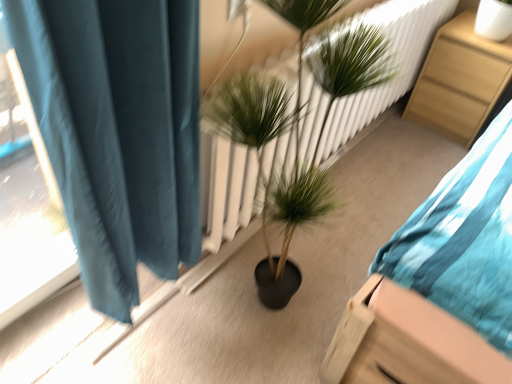
Question: From the image's perspective, is wooden nightstand at right located above or below green leafy plant at center?

Choices:
 (A) below
 (B) above

Answer: (B)

Question: Choose the correct answer: Is wooden nightstand at right inside green leafy plant at center or outside it?

Choices:
 (A) inside
 (B) outside

Answer: (B)

Question: Is wooden nightstand at right bigger or smaller than green leafy plant at center?

Choices:
 (A) small
 (B) big

Answer: (A)

Question: Considering the positions of green leafy plant at center and wooden nightstand at right in the image, is green leafy plant at center wider or thinner than wooden nightstand at right?

Choices:
 (A) thin
 (B) wide

Answer: (A)

Question: From their relative heights in the image, would you say green leafy plant at center is taller or shorter than wooden nightstand at right?

Choices:
 (A) tall
 (B) short

Answer: (A)

Question: Choose the correct answer: Is green leafy plant at center inside wooden nightstand at right or outside it?

Choices:
 (A) inside
 (B) outside

Answer: (B)

Question: In the image, is green leafy plant at center positioned in front of or behind wooden nightstand at right?

Choices:
 (A) front
 (B) behind

Answer: (A)